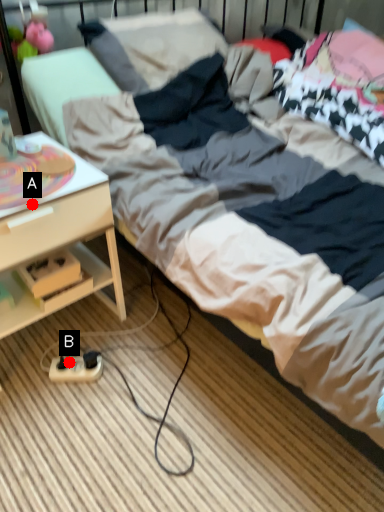
Question: Two points are circled on the image, labeled by A and B beside each circle. Among these points, which one is nearest to the camera?

Choices:
 (A) A is closer
 (B) B is closer

Answer: (A)